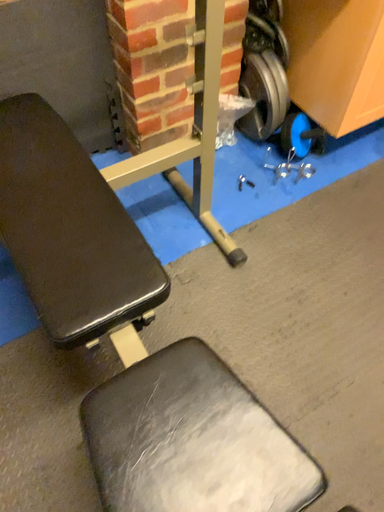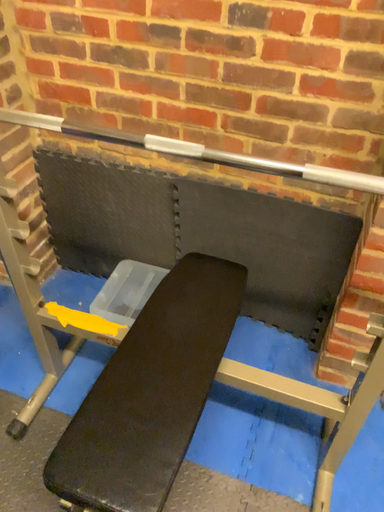
Question: Which way did the camera rotate in the video?

Choices:
 (A) rotated right
 (B) rotated left

Answer: (B)